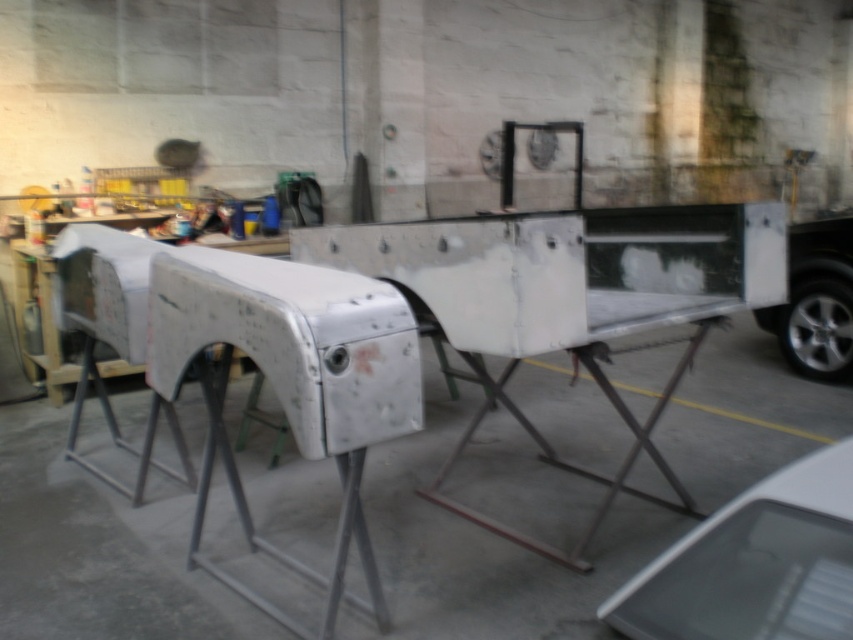
Is point (817, 636) positioned behind point (820, 321)?

No, (817, 636) is in front of (820, 321).

Measure the distance from white matte car at lower right to silver metallic car at right.

A distance of 4.10 meters exists between white matte car at lower right and silver metallic car at right.

The height and width of the screenshot is (640, 853). What do you see at coordinates (755, 563) in the screenshot? I see `white matte car at lower right` at bounding box center [755, 563].

I want to click on white matte car at lower right, so click(755, 563).